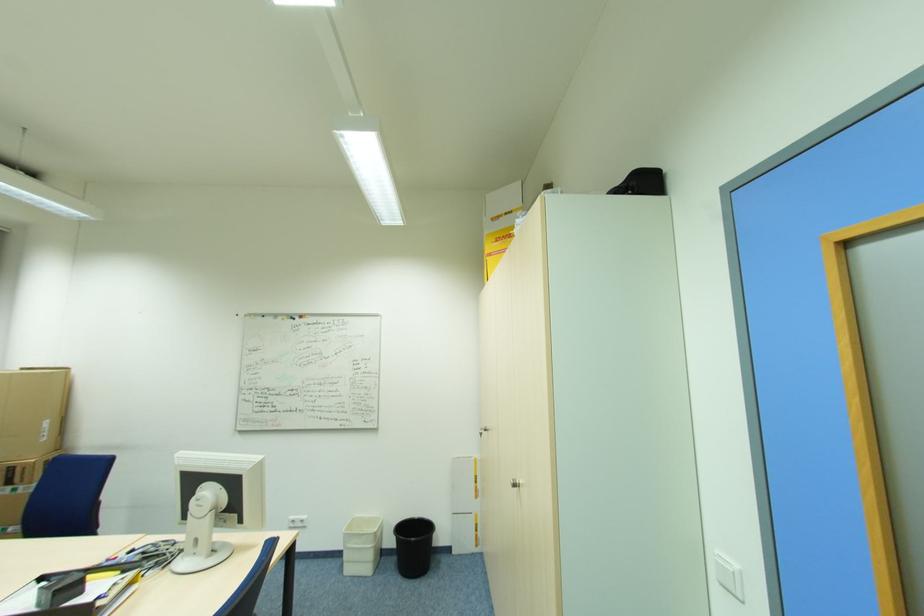
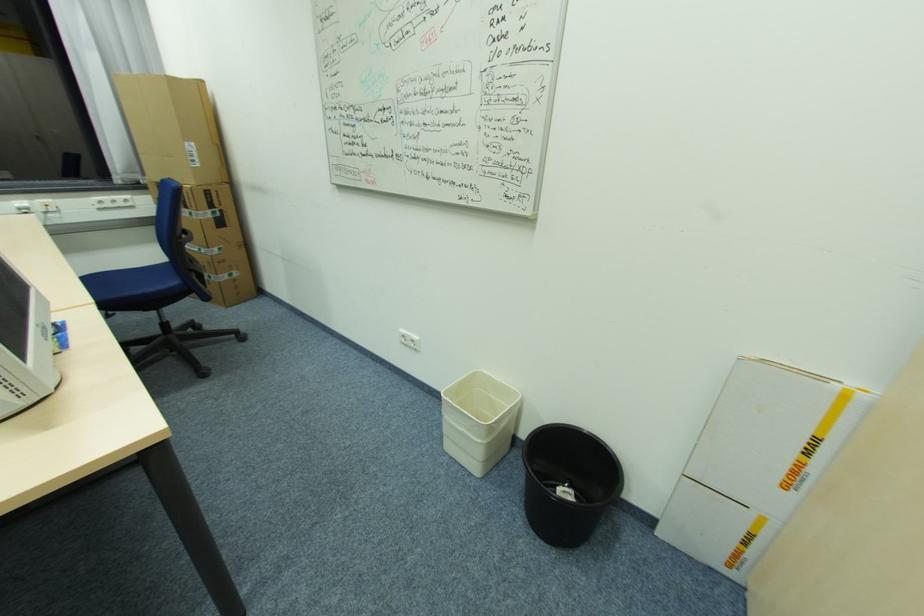
The point at (368, 578) is marked in the first image. Where is the corresponding point in the second image?

(472, 475)